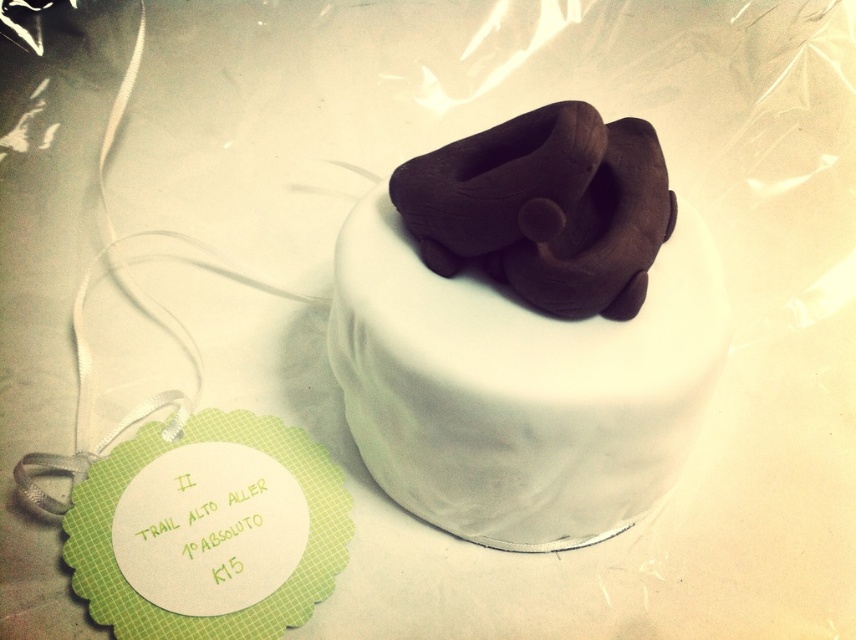
Locate an element on the screen. This screenshot has width=856, height=640. white smooth cake at center is located at coordinates (527, 330).